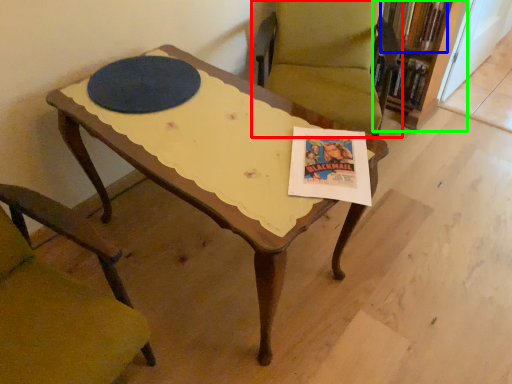
Question: Based on their relative distances, which object is nearer to chair (highlighted by a red box)? Choose from book (highlighted by a blue box) and bookcase (highlighted by a green box).

Choices:
 (A) book
 (B) bookcase

Answer: (B)